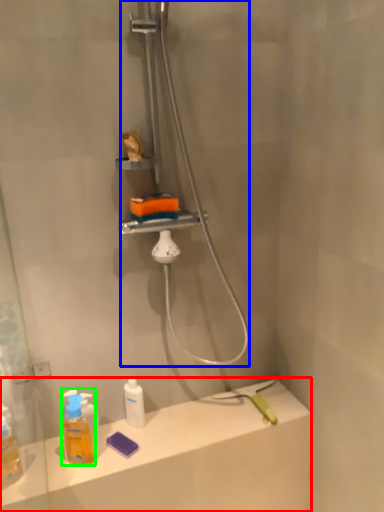
Question: Which is nearer to the counter top (highlighted by a red box)? shower (highlighted by a blue box) or mouthwash (highlighted by a green box).

Choices:
 (A) shower
 (B) mouthwash

Answer: (B)